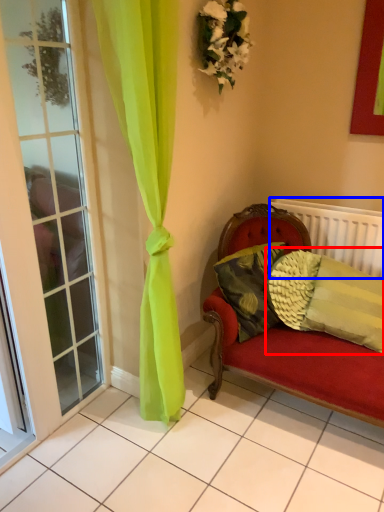
Question: Which point is further to the camera, pillow (highlighted by a red box) or radiator (highlighted by a blue box)?

Choices:
 (A) pillow
 (B) radiator

Answer: (B)